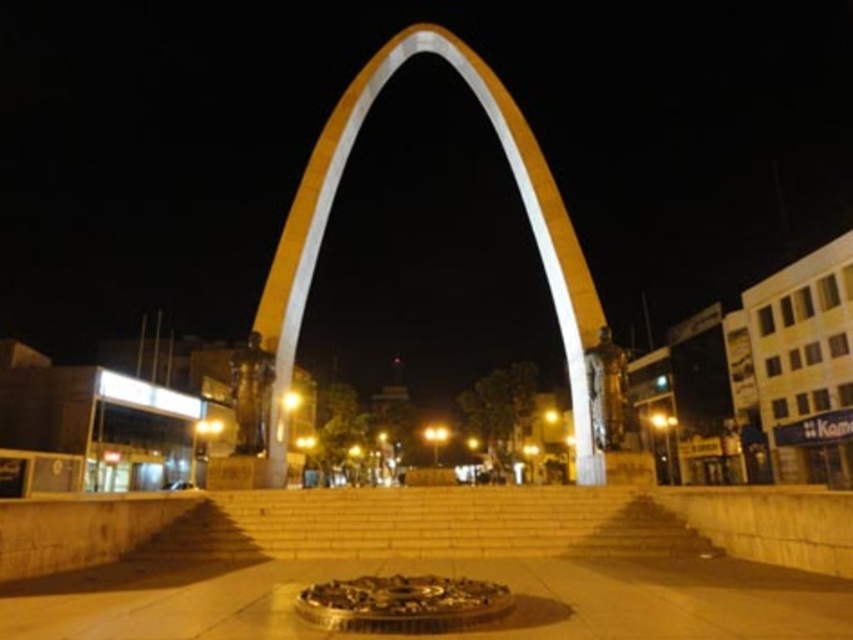
You are standing at the bottom of the light beige stone stairs at center and want to walk up to the yellow concrete arch at center. Which direction should you move to get closer to the arch?

You should move upward along the light beige stone stairs at center since they are closer to you and lead up to the yellow concrete arch at center.

You are standing at the bottom of the light beige stone stairs at center and want to reach the top of the yellow concrete arch at center. Which object is closer to your current position?

The light beige stone stairs at center is closer to your current position since you are already at its base, while the yellow concrete arch at center is taller and further away.